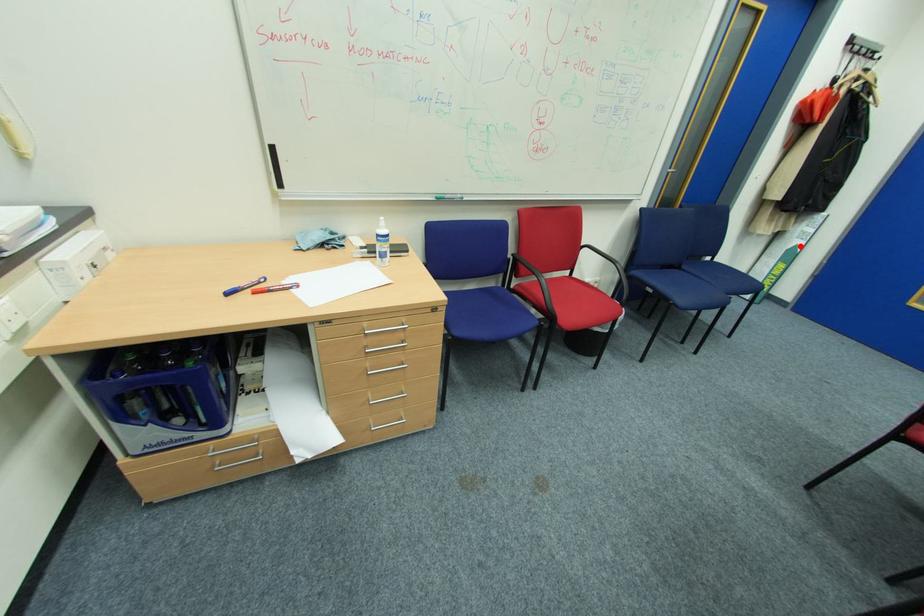
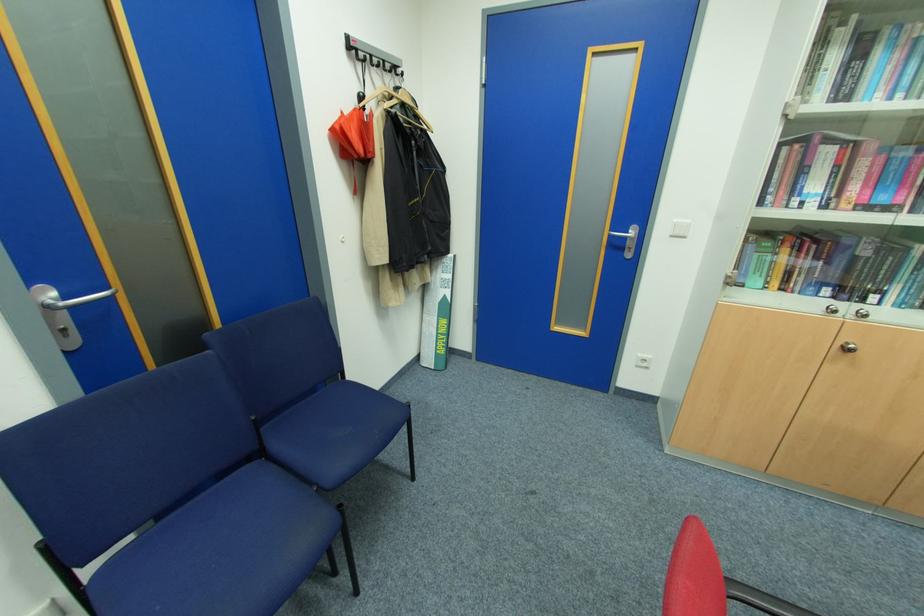
In the second image, find the point that corresponds to the highlighted location in the first image.

(448, 296)